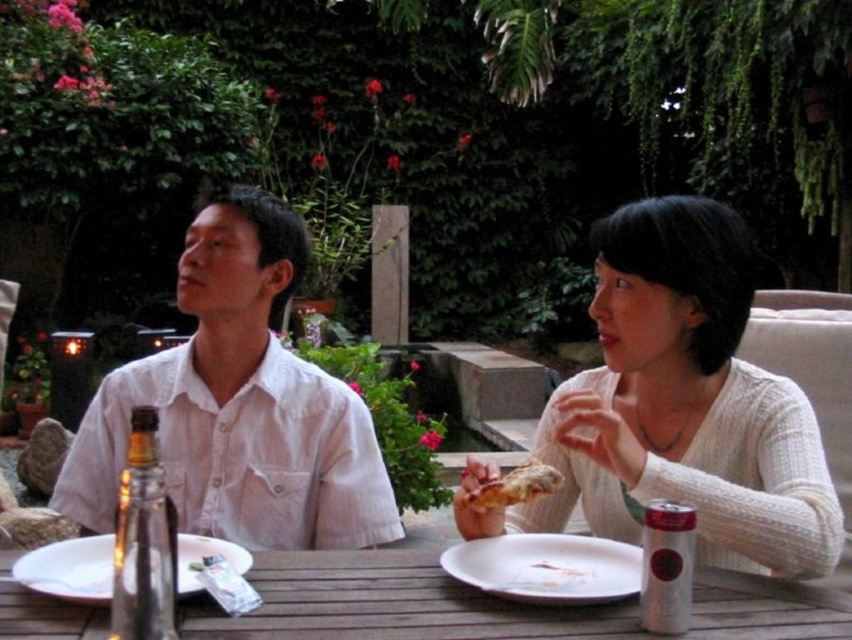
Question: Does white knitted sweater at center appear over wooden table at center?

Choices:
 (A) yes
 (B) no

Answer: (A)

Question: Based on their relative distances, which object is farther from the clear glass bottle at lower left?

Choices:
 (A) white linen shirt at upper left
 (B) white linen shirt at center
 (C) wooden table at center

Answer: (A)

Question: Among these points, which one is farthest from the camera?

Choices:
 (A) (266, 291)
 (B) (499, 502)

Answer: (A)

Question: Observing the image, what is the correct spatial positioning of clear glass bottle at lower left in reference to golden crispy pizza at center?

Choices:
 (A) below
 (B) above

Answer: (B)

Question: Which point appears closest to the camera in this image?

Choices:
 (A) (220, 305)
 (B) (721, 314)
 (C) (494, 499)

Answer: (C)

Question: Is white knitted sweater at center closer to camera compared to golden crispy pizza at center?

Choices:
 (A) yes
 (B) no

Answer: (A)